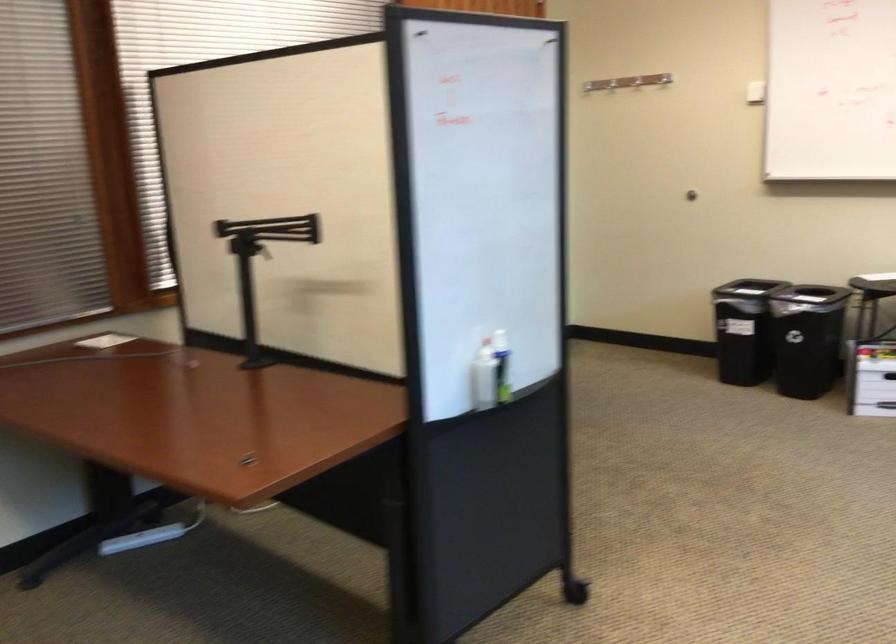
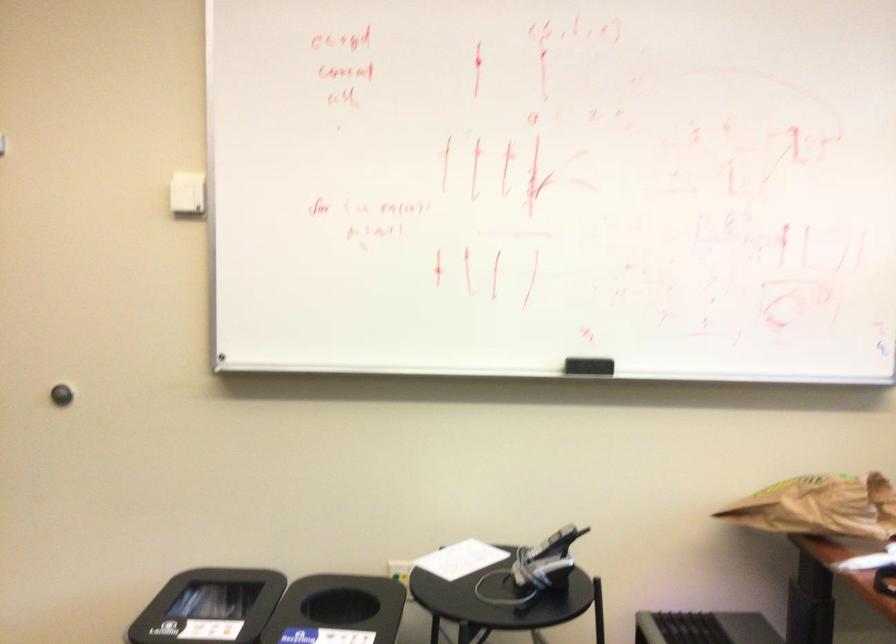
Question: I am providing you with two images of the same scene from different viewpoints. Which of the following objects are not visible in image2?

Choices:
 (A) phone handset
 (B) white light switch
 (C) black board eraser
 (D) none of these

Answer: (D)